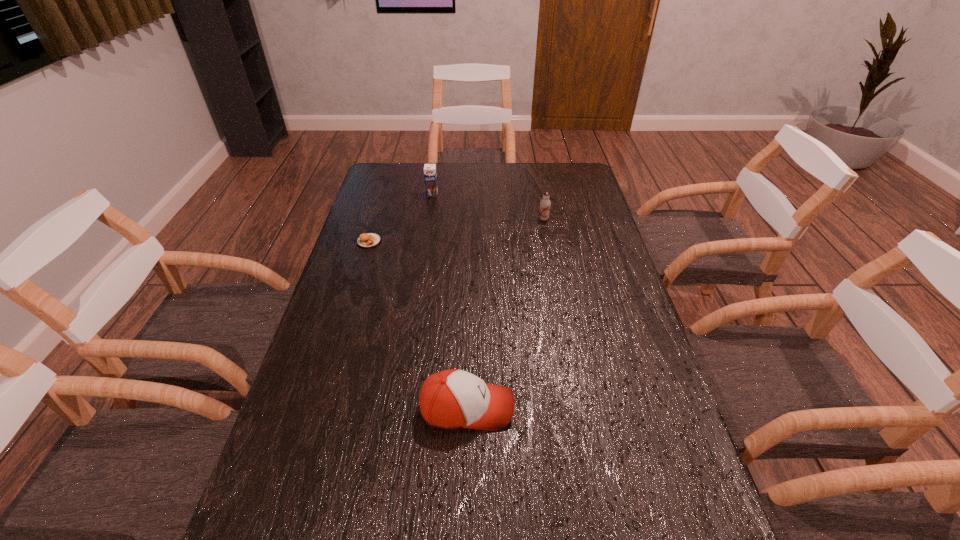
What are the coordinates of `free space that satisfies the following two spatial constraints: 1. on the back side of the third nearest object; 2. on the left side of the leftmost object` in the screenshot? It's located at (376, 219).

Identify the location of free space that satisfies the following two spatial constraints: 1. on the front label of the third object from right to left; 2. on the right side of the nearer chocolate milk. (428, 219).

Locate an element on the screen. Image resolution: width=960 pixels, height=540 pixels. free space that satisfies the following two spatial constraints: 1. on the front label of the shorter chocolate milk; 2. on the right side of the second object from left to right is located at coordinates (428, 219).